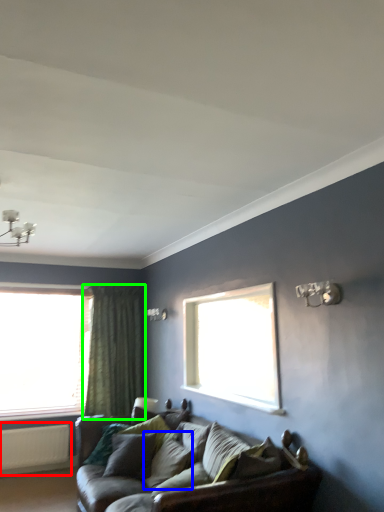
Question: Estimate the real-world distances between objects in this image. Which object is farther from radiator (highlighted by a red box), pillow (highlighted by a blue box) or curtain (highlighted by a green box)?

Choices:
 (A) pillow
 (B) curtain

Answer: (A)